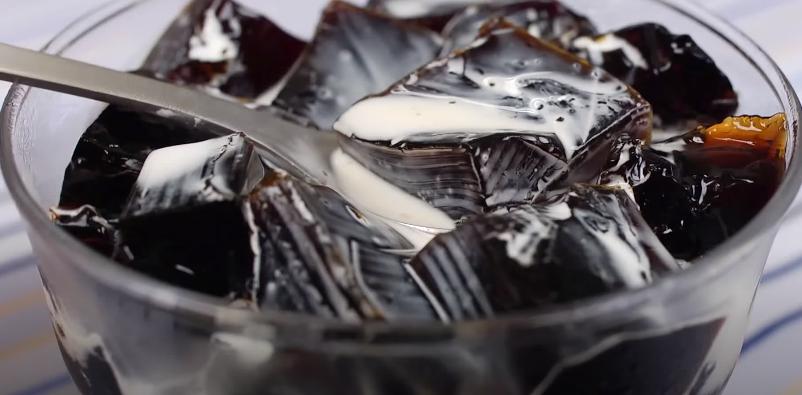
Find where utensil handle meets bowl rim in the image. Your answer should be formatted as a list of tuples, i.e. [(x1, y1), (x2, y2), ...], where each tuple contains the x and y coordinates of a point satisfying the conditions above.

[(18, 81)]